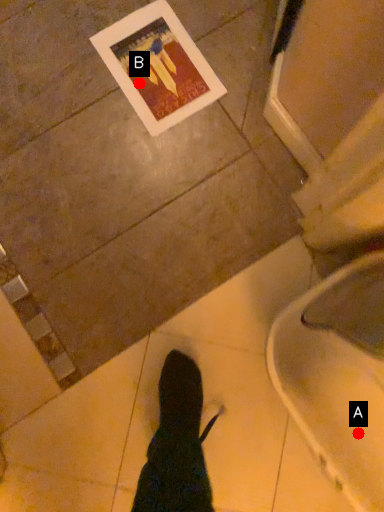
Question: Two points are circled on the image, labeled by A and B beside each circle. Which point appears farthest from the camera in this image?

Choices:
 (A) A is further
 (B) B is further

Answer: (B)